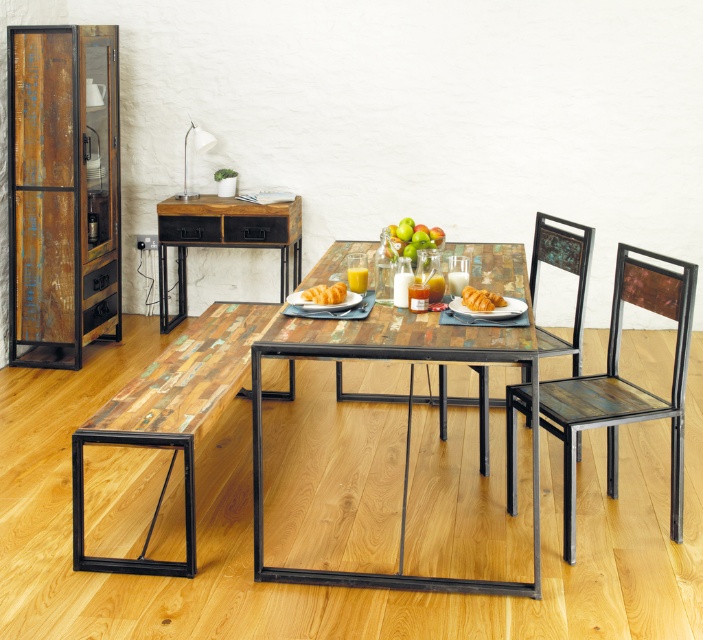
You are standing in the dining area and looking at the table. There are two points marked on the table surface. The first point is at coordinates point (347, 323) and the second is at point (437, 236). Which point appears closer to you when looking directly at the table?

Point (347, 323) is closer to the camera than point (437, 236), so it appears closer when looking directly at the table.

You are standing in the dining area and want to grab a croissant from the multicolored wood table at center. If your arm can reach 3 feet, can you reach the croissant without moving closer?

The multicolored wood table at center is 9.78 feet away from you, which is farther than your 3 feet reach. You need to move closer to reach the croissant.